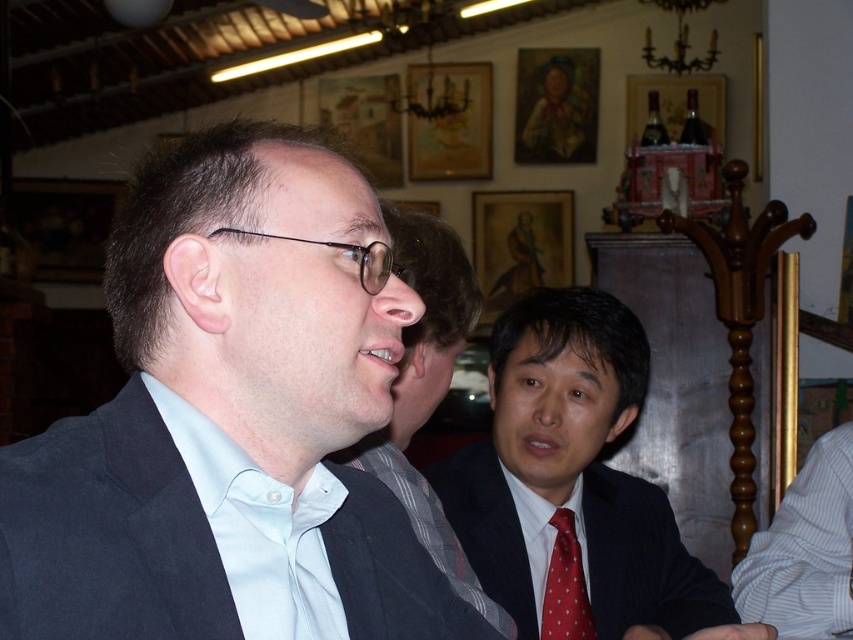
Question: Is matte black suit at center to the right of white striped shirt at lower right from the viewer's perspective?

Choices:
 (A) yes
 (B) no

Answer: (B)

Question: Does matte gray vest at center lie in front of white striped shirt at lower right?

Choices:
 (A) no
 (B) yes

Answer: (B)

Question: Does matte black suit at center appear on the left side of polished dark suit at center?

Choices:
 (A) yes
 (B) no

Answer: (A)

Question: Considering the real-world distances, which object is farthest from the red dotted fabric tie at center?

Choices:
 (A) matte black suit at center
 (B) white striped shirt at lower right
 (C) polished dark suit at center
 (D) matte gray vest at center

Answer: (A)

Question: Which point is closer to the camera taking this photo?

Choices:
 (A) (820, 557)
 (B) (436, 339)
 (C) (560, 600)

Answer: (B)

Question: Estimate the real-world distances between objects in this image. Which object is closer to the matte gray vest at center?

Choices:
 (A) white striped shirt at lower right
 (B) matte black suit at center

Answer: (B)